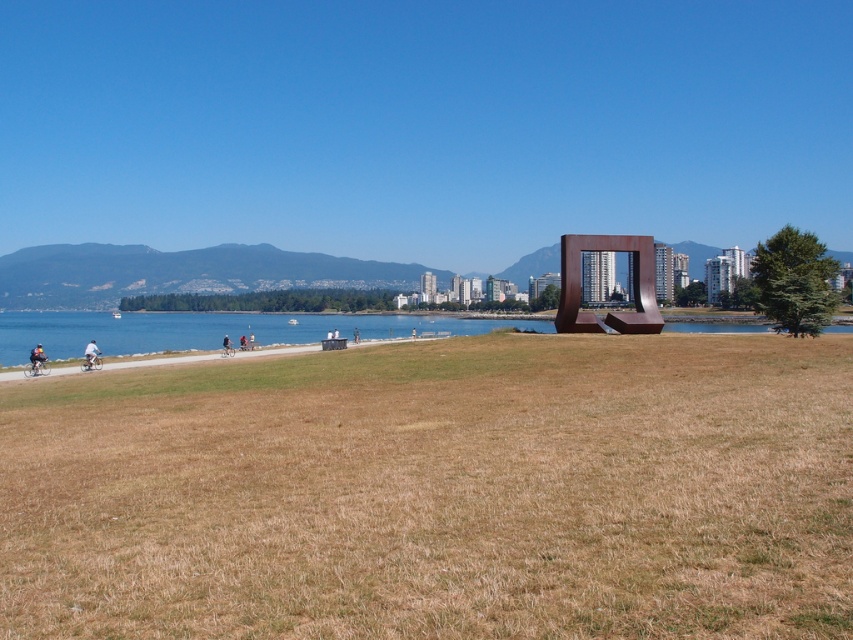
You are standing at the point with coordinates [631,284] in the image. What object is located exactly at this point?

The rustic metal sculpture at center is located exactly at point [631,284].

You are planning to install a new bench along the pathway. The bench requires a space wider than the brown dry grass at center and the rustic metal sculpture at center. Which object should you avoid placing the bench next to to ensure enough space?

You should avoid placing the bench next to the rustic metal sculpture at center because the brown dry grass at center is wider than the rustic metal sculpture at center, so the sculpture area may not provide enough space for the bench.